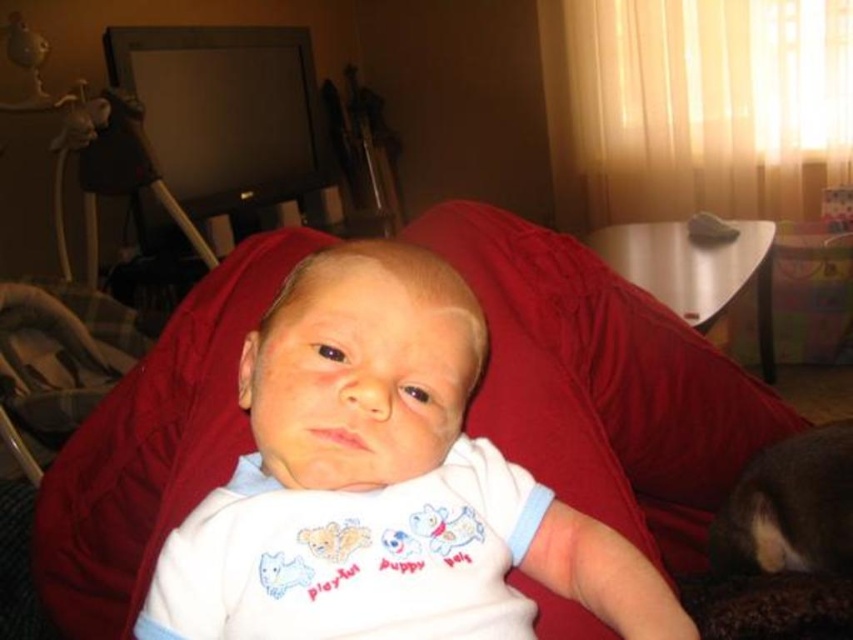
Is white soft fabric baby at center below metallic gray armchair at left?

Correct, white soft fabric baby at center is located below metallic gray armchair at left.

Who is positioned more to the left, white soft fabric baby at center or metallic gray armchair at left?

metallic gray armchair at left

What do you see at coordinates (381, 483) in the screenshot? I see `white soft fabric baby at center` at bounding box center [381, 483].

Find the location of a particular element. Image resolution: width=853 pixels, height=640 pixels. white soft fabric baby at center is located at coordinates (381, 483).